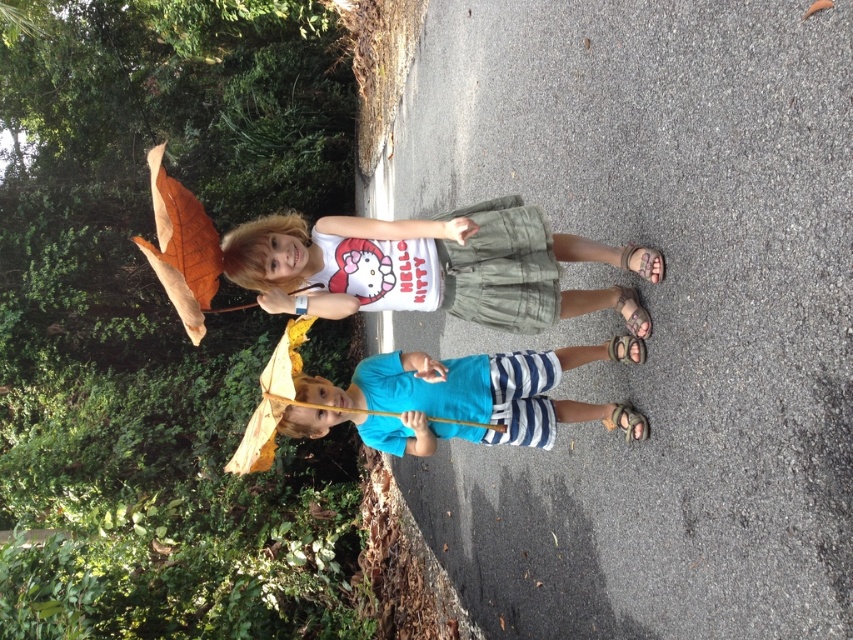
Based on the photo, you are a fashion designer observing two children in a park. You notice the white cotton shirt at center and the blue striped shorts at center. Which clothing item is bigger in size?

The white cotton shirt at center is larger in size than the blue striped shorts at center.

You are a fashion designer observing two children in a park. You notice the white cotton shirt at center and the blue striped shorts at center. Which clothing item is taller?

The white cotton shirt at center is taller than the blue striped shorts at center.